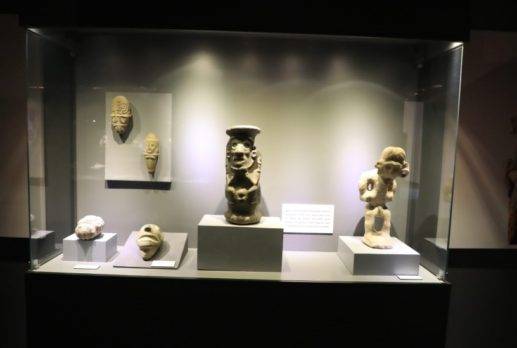
Identify the location of flat display stands. This screenshot has height=348, width=517. [229, 241], [390, 261], [96, 248], [177, 294], [11, 238], [490, 260].